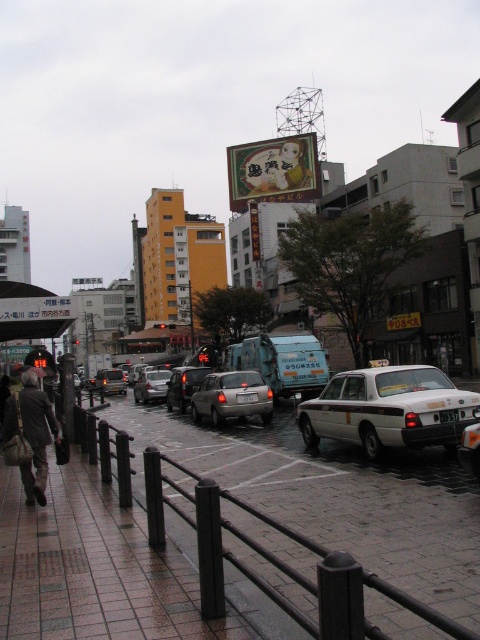
Question: Considering the real-world distances, which object is farthest from the brick pavement at lower left?

Choices:
 (A) white glossy taxi at center
 (B) satin silver sedan at center
 (C) matte black sedan at center
 (D) silver metallic sedan at center

Answer: (C)

Question: Is the position of satin silver sedan at center more distant than that of shiny silver sedan at center?

Choices:
 (A) no
 (B) yes

Answer: (A)

Question: Is the position of brown leather jacket at lower left less distant than that of shiny silver sedan at center?

Choices:
 (A) no
 (B) yes

Answer: (B)

Question: Is white glossy taxi at center wider than silver metallic sedan at center?

Choices:
 (A) no
 (B) yes

Answer: (A)

Question: Which object is farther from the camera taking this photo?

Choices:
 (A) blue metallic garbage truck at center
 (B) white glossy taxi at center

Answer: (A)

Question: Which of the following is the closest to the observer?

Choices:
 (A) (427, 419)
 (B) (325, 502)

Answer: (B)